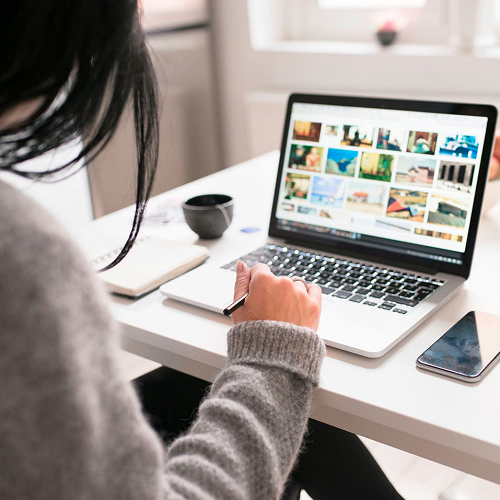
The image size is (500, 500). What are the coordinates of `key board` in the screenshot? It's located at (340, 269).